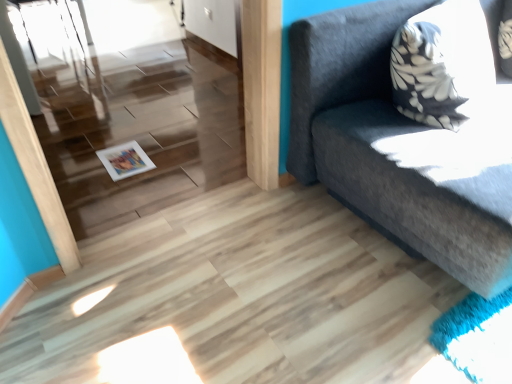
Identify the location of empty space that is ontop of white glossy magazine at lower left. (126, 160).